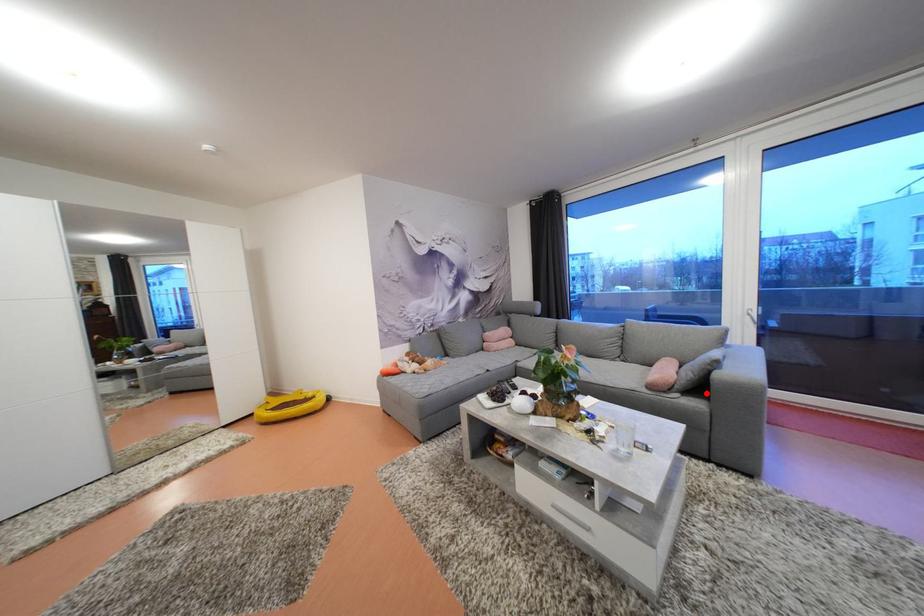
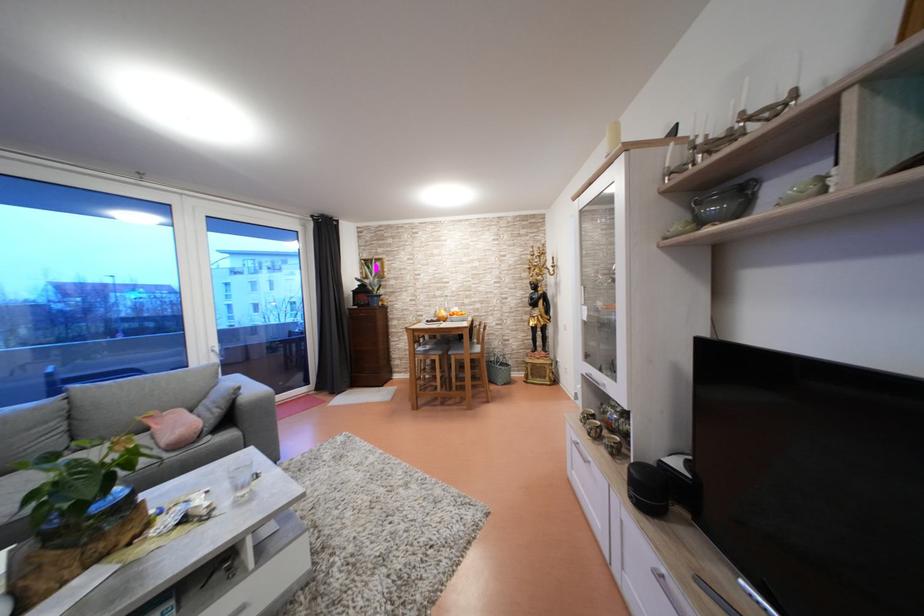
The point at the highlighted location is marked in the first image. Where is the corresponding point in the second image?

(237, 424)